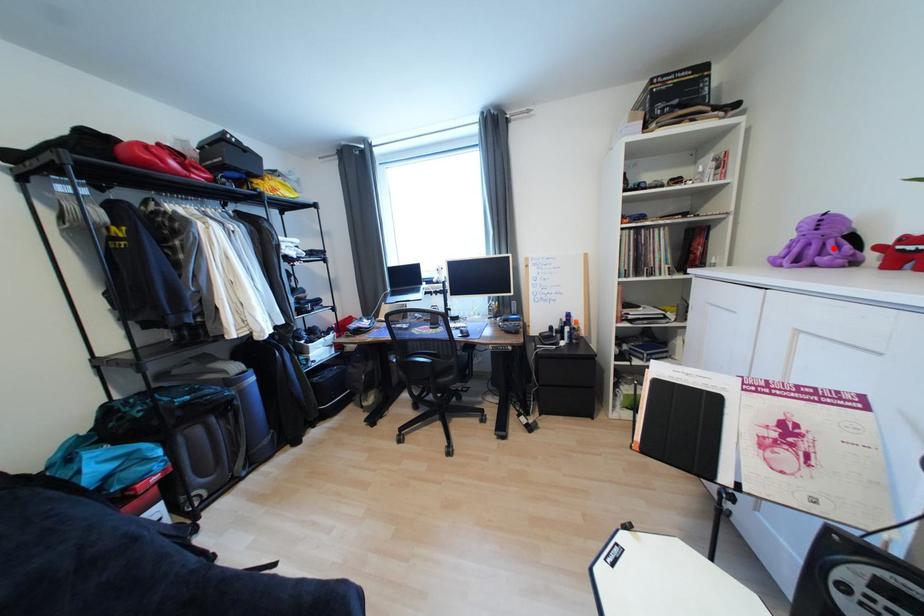
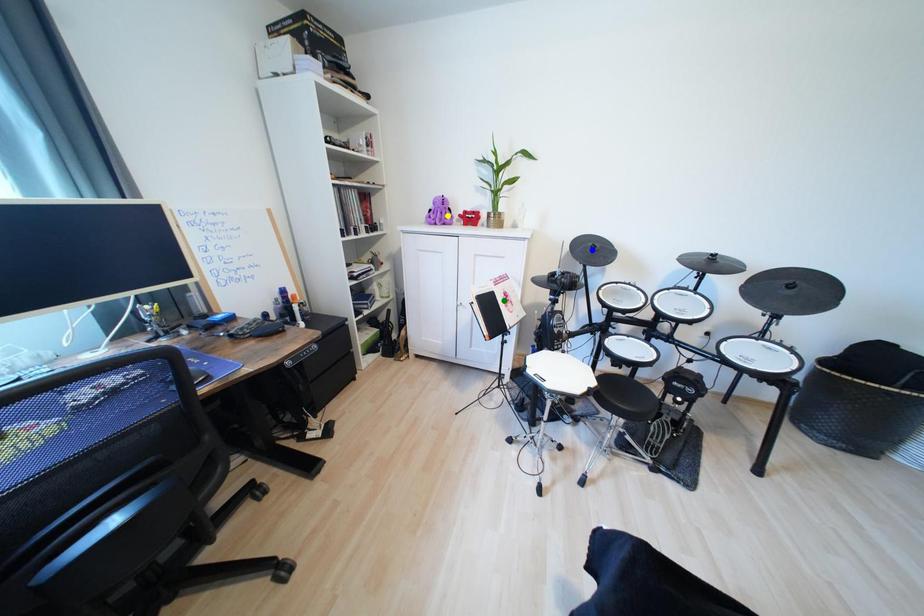
Question: I am providing you with two images of the same scene from different viewpoints. A red point is marked on the first image. You are given multiple points on the second image. In image 2, which mark is for the same physical point as the one in image 1?

Choices:
 (A) blue point
 (B) green point
 (C) yellow point

Answer: (C)